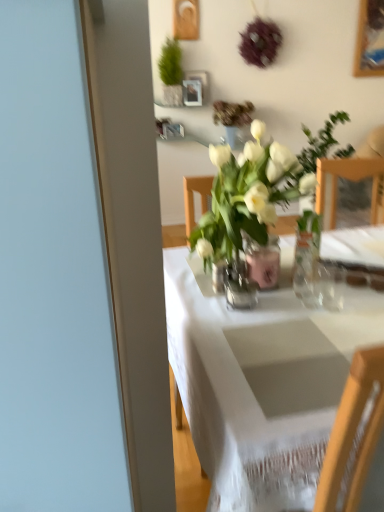
What are the coordinates of `vacant area to the right of clear glass vase at center, the 2th vase viewed from the back` in the screenshot? It's located at (301, 305).